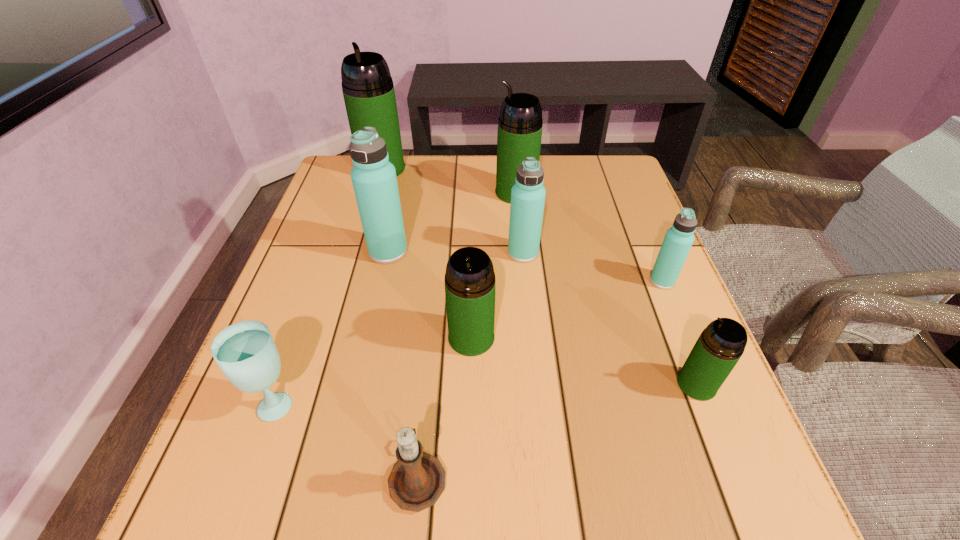
Where is `object located in the far left corner section of the desktop`? Image resolution: width=960 pixels, height=540 pixels. object located in the far left corner section of the desktop is located at coordinates (367, 86).

Where is `vacant region at the far edge of the desktop`? vacant region at the far edge of the desktop is located at coordinates (478, 163).

At what (x,y) coordinates should I click in order to perform the action: click on vacant space at the near edge of the desktop. Please return your answer as a coordinate pair (x, y). This screenshot has width=960, height=540. Looking at the image, I should click on 587,491.

Identify the location of blank space at the left edge. The image size is (960, 540). (296, 257).

Identify the location of vacant region at the right edge of the desktop. This screenshot has width=960, height=540. (590, 217).

The image size is (960, 540). What are the coordinates of `vacant space at the far left corner of the desktop` in the screenshot? It's located at point(327,197).

Identify the location of vacant area at the far right corner of the desktop. This screenshot has width=960, height=540. (618, 166).

Where is `free space between the biggest green thermos bottle and the glass`? The width and height of the screenshot is (960, 540). free space between the biggest green thermos bottle and the glass is located at coordinates (330, 285).

Where is `unoccupied position between the nearest thermos bottle and the second nearest green thermos bottle`? unoccupied position between the nearest thermos bottle and the second nearest green thermos bottle is located at coordinates (584, 361).

This screenshot has height=540, width=960. In order to click on vacant space that's between the second smallest aqua thermos bottle and the biggest green thermos bottle in this screenshot , I will do pyautogui.click(x=452, y=211).